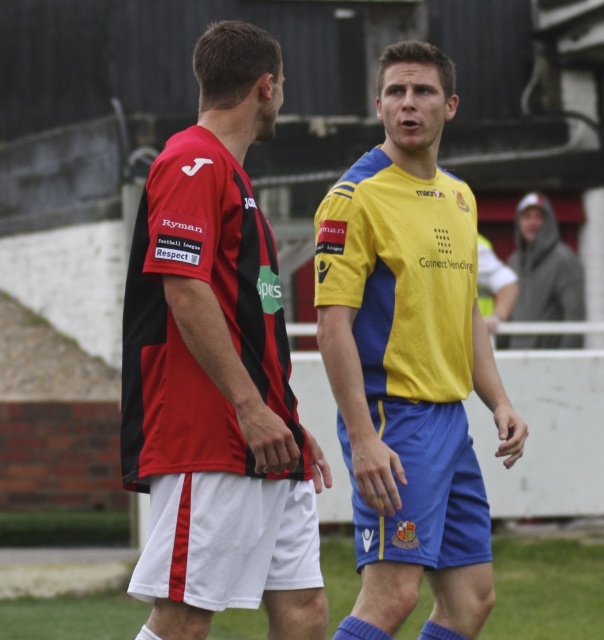
You are a photographer standing at the edge of the soccer field. You want to take a closeup photo of the matte black and red jersey at left. The camera you are using has a minimum focusing distance of 100 feet. Can you take the photo without moving closer?

The matte black and red jersey at left is 95.16 feet away from the camera. Since the minimum focusing distance is 100 feet, you need to move back or use a different camera with a shorter minimum focusing distance to capture the closeup.

Looking at this image, you are standing on the soccer field and see two points marked on the ground at coordinates point (149, 368) and point (143, 616). If you want to walk towards the point that is closer to the goal located at the far end of the field, which coordinate should you head towards?

Point (149, 368) is in front of point (143, 616), so it is closer to the goal located at the far end of the field. You should head towards point (149, 368).

You are a photographer standing at the edge of the soccer field. You need to capture a clear photo of both the matte black and red jersey at left and the green grass at lower center. Which object will appear larger in the photo?

The matte black and red jersey at left will appear larger in the photo because it is bigger than the green grass at lower center.